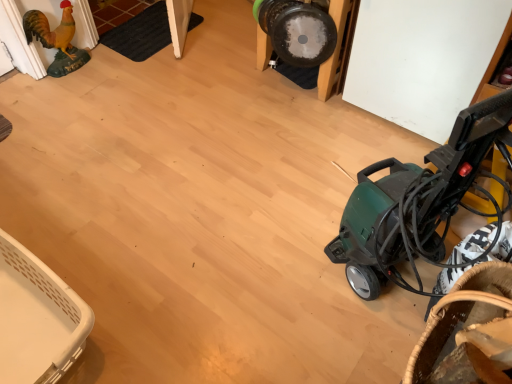
The width and height of the screenshot is (512, 384). Find the location of `free space that is in between golden matte chicken at left and green plastic vacuum cleaner at right`. free space that is in between golden matte chicken at left and green plastic vacuum cleaner at right is located at coordinates (204, 159).